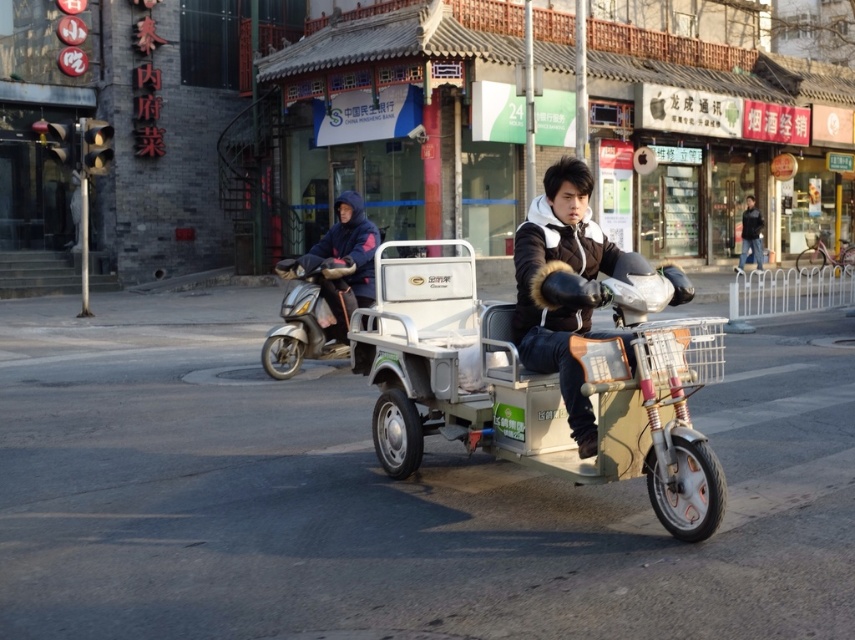
Question: Does shiny metallic scooter at center-left appear on the left side of black leather jacket at upper right?

Choices:
 (A) yes
 (B) no

Answer: (A)

Question: Does metallic silver cart at center have a greater width compared to black leather jacket at upper right?

Choices:
 (A) no
 (B) yes

Answer: (B)

Question: Which object appears farthest from the camera in this image?

Choices:
 (A) dark blue jacket at center
 (B) metallic silver cart at center
 (C) black fuzzy jacket at center
 (D) black leather jacket at upper right

Answer: (D)

Question: Which point is closer to the camera?

Choices:
 (A) (758, 228)
 (B) (345, 218)
 (C) (420, 273)
 (D) (550, 364)

Answer: (D)

Question: Is metallic silver cart at center further to camera compared to dark blue jacket at center?

Choices:
 (A) no
 (B) yes

Answer: (A)

Question: Which point is farther to the camera?

Choices:
 (A) (746, 243)
 (B) (587, 276)
 (C) (335, 326)
 (D) (345, 240)

Answer: (A)